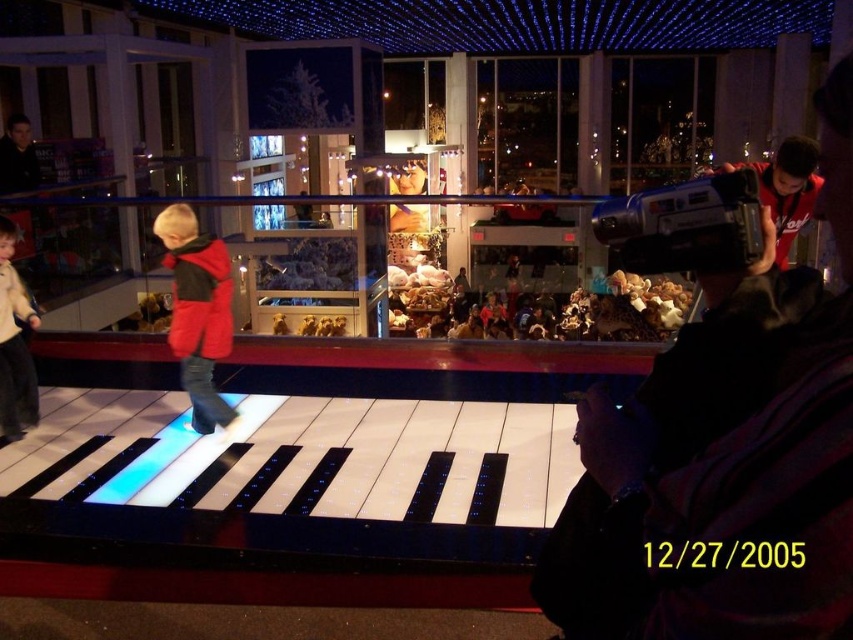
Is red matte jacket at center shorter than light beige sweater at left?

In fact, red matte jacket at center may be taller than light beige sweater at left.

Is point (172, 225) farther from camera compared to point (26, 365)?

No, (172, 225) is in front of (26, 365).

You are a GUI agent. You are given a task and a screenshot of the screen. Output one action in this format:
    pyautogui.click(x=<x>, y=<y>)
    Task: Click on the red matte jacket at center
    
    Given the screenshot: What is the action you would take?
    pyautogui.click(x=196, y=310)

Image resolution: width=853 pixels, height=640 pixels. What do you see at coordinates (724, 460) in the screenshot?
I see `matte black camera at right` at bounding box center [724, 460].

Who is more forward, (602,513) or (7,317)?

Point (602,513) is in front.

Identify the location of matte black camera at right. (724, 460).

This screenshot has width=853, height=640. Identify the location of matte black camera at right. (724, 460).

Can you confirm if matte black camera at right is positioned to the left of red matte jacket at center?

In fact, matte black camera at right is to the right of red matte jacket at center.

Where is `matte black camera at right`? The width and height of the screenshot is (853, 640). matte black camera at right is located at coordinates (724, 460).